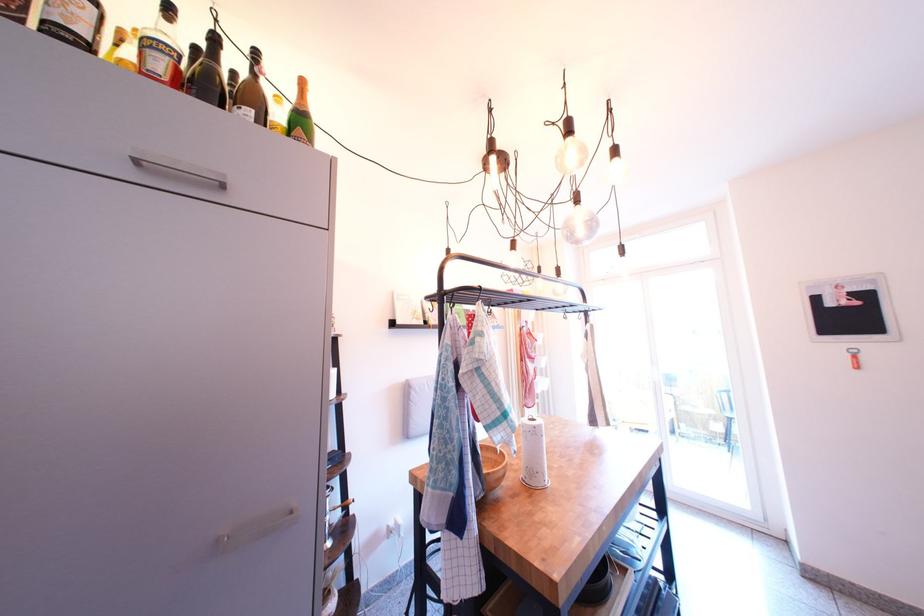
Where would you lift the dark liquor bottle? Please return your answer as a coordinate pair (x, y).

(73, 23)